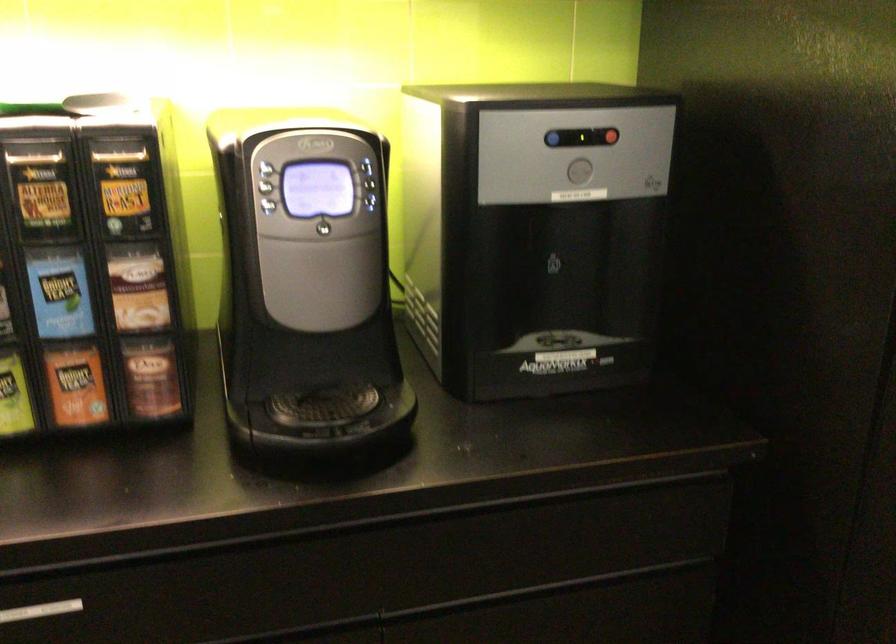
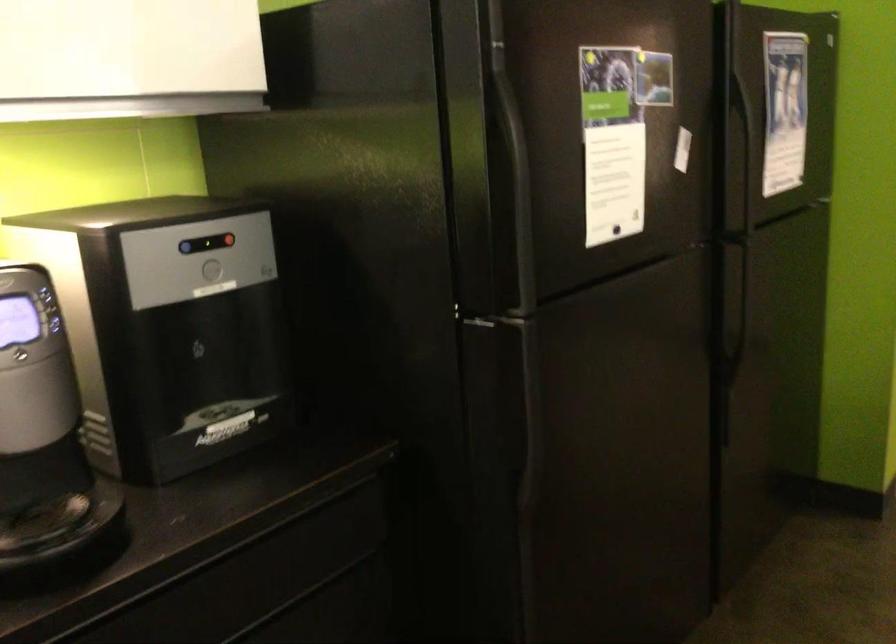
Where in the second image is the point corresponding to the point at 607,134 from the first image?

(227, 240)